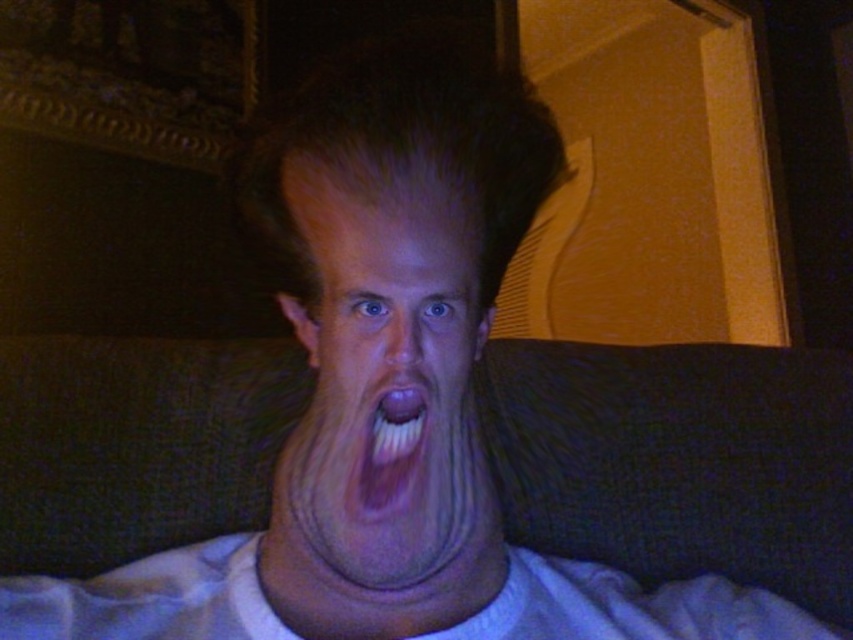
You are a photographer trying to capture the perfect shot of the person yelling. The camera you are using has a focal length of 50mm and an aperture of f2.8. You want to ensure that the point at point (415, 582) is in focus. What is the minimum distance you should be from the person to achieve this?

The point at point (415, 582) is 14.13 inches from the camera. To ensure this point is in focus, the photographer should maintain a distance of at least 14.13 inches from the person.

You are standing in a room and see a person sitting on a couch with an exaggerated facial expression. There is a point at coordinates point (432, 468). Can you reach that point with your hand if you extend it fully?

The distance between point (432, 468) and the viewer is 13.07 inches. Since the average human arm extension is about 24 inches, you can easily reach the point.